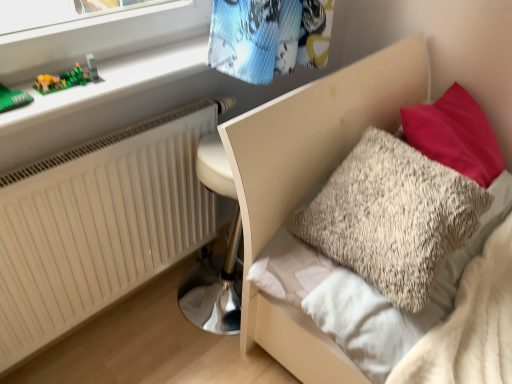
I want to click on empty space that is ontop of green plastic blocks at upper left (from a real-world perspective), so click(x=101, y=79).